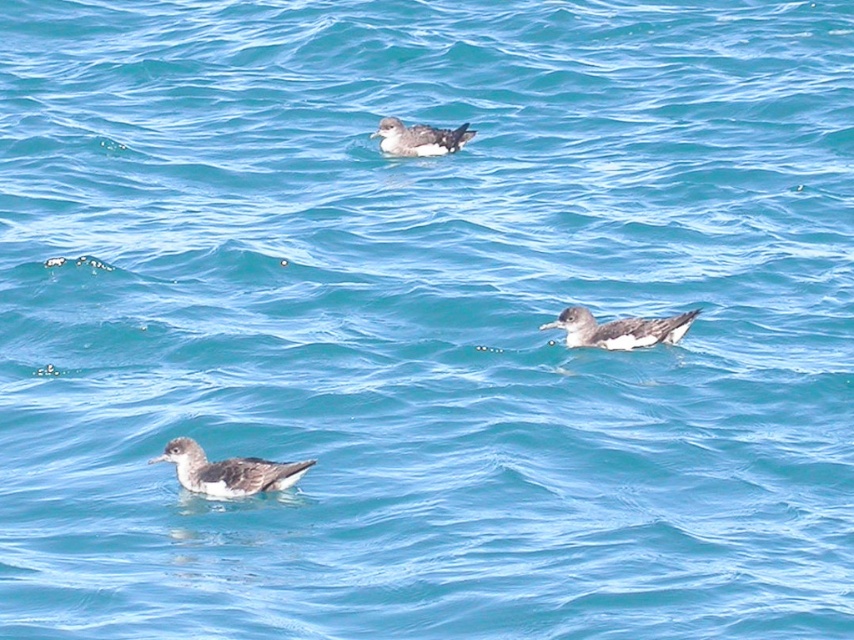
You are a photographer trying to capture a closeup of the speckled gray bird at center and the dark gray feathers at upper center. Which one would you need to zoom in more on to fill the frame?

The speckled gray bird at center occupies less space than the dark gray feathers at upper center, so you would need to zoom in more on the speckled gray bird at center to fill the frame.

You are a wildlife photographer aiming to capture the speckled gray bird at center and the dark gray speckled bird at center in a photo. Which bird should you focus on if you want to highlight the tallest one in your shot?

The speckled gray bird at center has a greater height compared to the dark gray speckled bird at center, so you should focus on the speckled gray bird at center to highlight the tallest one.

You are a photographer trying to capture the speckled gray bird at center in the image. The bird is located at coordinates point 0.738, 0.267. If you want to focus on the bird, where should you aim your camera? Please provide the coordinates in the format of point X, Y.

The speckled gray bird at center is located at point (227, 472). You should aim your camera at point (227, 472) to focus on the bird.